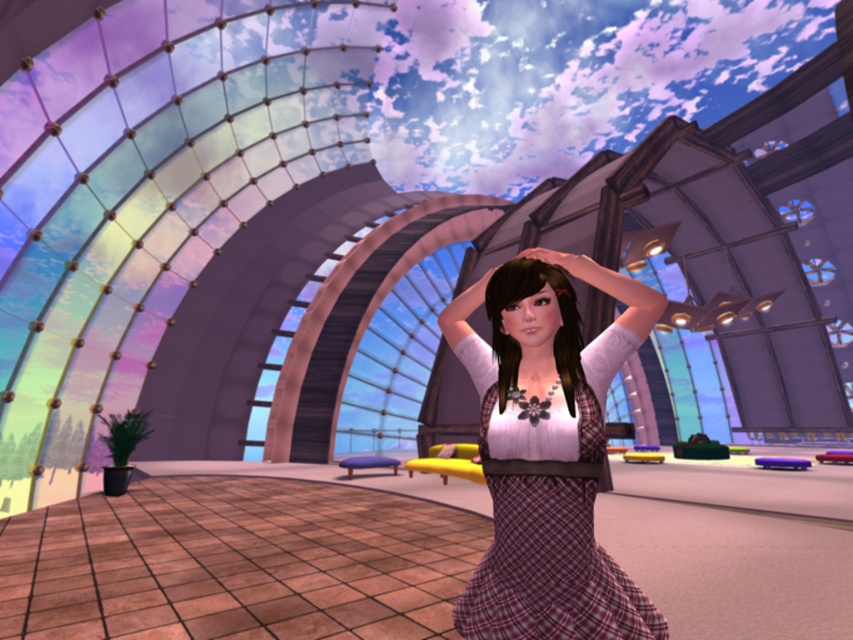
You are a fashion designer analyzing the positioning of clothing items in a futuristic setting. The scene includes a plaid fabric dress at center and a matte black hair at center. Based on the spatial relationship between these two items, can the dress be worn with the hairdo without any adjustments?

The plaid fabric dress at center and matte black hair at center are 43.08 centimeters apart, so yes, the dress can be worn with the hairdo without any adjustments as there is sufficient space between them.

You are a character in this futuristic setting and want to touch your pink matte hand at center with your matte black hair at center. Can you reach it based on their positions?

The matte black hair at center is closer to the viewer than the pink matte hand at center, so the hair cannot physically reach the hand since it is positioned in front of it.